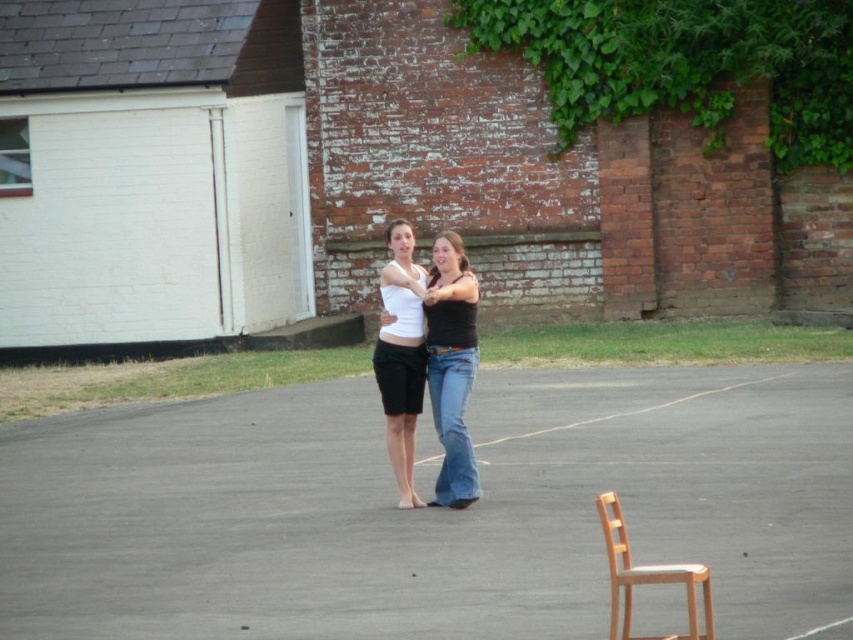
Question: Does white matte shorts at center appear under light brown wooden chair at lower right?

Choices:
 (A) yes
 (B) no

Answer: (B)

Question: Is the position of white matte shorts at center more distant than that of light brown wooden chair at lower right?

Choices:
 (A) yes
 (B) no

Answer: (A)

Question: Which point is closer to the camera?

Choices:
 (A) light brown wooden chair at lower right
 (B) white matte shorts at center
 (C) matte black shorts at center

Answer: (A)

Question: Which object appears farthest from the camera in this image?

Choices:
 (A) light brown wooden chair at lower right
 (B) matte black shorts at center
 (C) white matte shorts at center

Answer: (C)

Question: Does white matte shorts at center have a smaller size compared to light brown wooden chair at lower right?

Choices:
 (A) no
 (B) yes

Answer: (A)

Question: Which point is farther to the camera?

Choices:
 (A) [x=433, y=403]
 (B) [x=401, y=266]
 (C) [x=611, y=513]

Answer: (A)